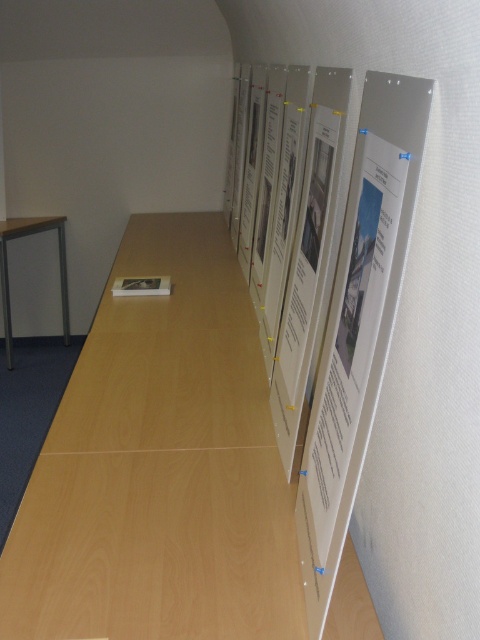
Question: Which of the following is the closest to the observer?

Choices:
 (A) (25, 225)
 (B) (307, 516)

Answer: (B)

Question: From the image, what is the correct spatial relationship of white paper at upper right in relation to matte black table at left?

Choices:
 (A) right
 (B) left

Answer: (A)

Question: Among these points, which one is nearest to the camera?

Choices:
 (A) (35, 227)
 (B) (313, 396)

Answer: (B)

Question: Can you confirm if white paper at upper right is bigger than matte black table at left?

Choices:
 (A) no
 (B) yes

Answer: (A)

Question: Can you confirm if white paper at upper right is bigger than matte black table at left?

Choices:
 (A) no
 (B) yes

Answer: (A)

Question: Which of the following is the closest to the observer?

Choices:
 (A) matte black table at left
 (B) white paper at upper right

Answer: (B)